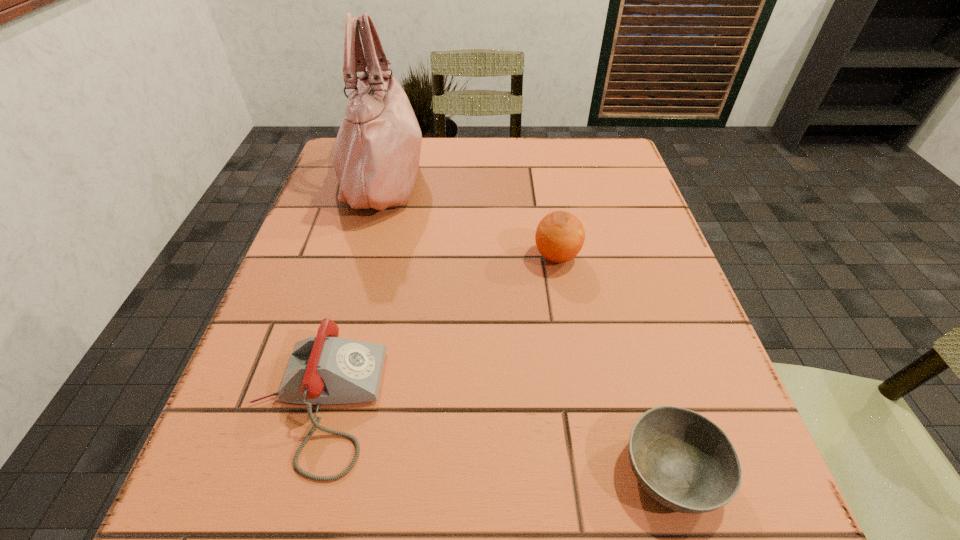
In the image, there is a desktop. Identify the location of vacant area at the near edge. [x=611, y=510].

What are the coordinates of `vacant space at the left edge` in the screenshot? It's located at (359, 235).

Image resolution: width=960 pixels, height=540 pixels. Identify the location of vacant position at the right edge of the desktop. (693, 314).

You are a GUI agent. You are given a task and a screenshot of the screen. Output one action in this format:
    pyautogui.click(x=<x>, y=<y>)
    Task: Click on the vacant space at the far left corner
    
    Given the screenshot: What is the action you would take?
    pyautogui.click(x=327, y=173)

This screenshot has width=960, height=540. In the image, there is a desktop. Identify the location of vacant space at the near left corner. click(231, 497).

Find the location of a particular element. This screenshot has width=960, height=540. vacant region between the handbag and the second shortest object is located at coordinates (349, 290).

This screenshot has height=540, width=960. Find the location of `free area in between the second tallest object and the bowl`. free area in between the second tallest object and the bowl is located at coordinates (614, 363).

This screenshot has width=960, height=540. Identify the location of vacant point located between the third shortest object and the tallest object. (469, 217).

Find the location of a particular element. Image resolution: width=960 pixels, height=540 pixels. free space between the third tallest object and the orange is located at coordinates (436, 330).

The image size is (960, 540). What are the coordinates of `free area in between the tallest object and the second tallest object` in the screenshot? It's located at (469, 217).